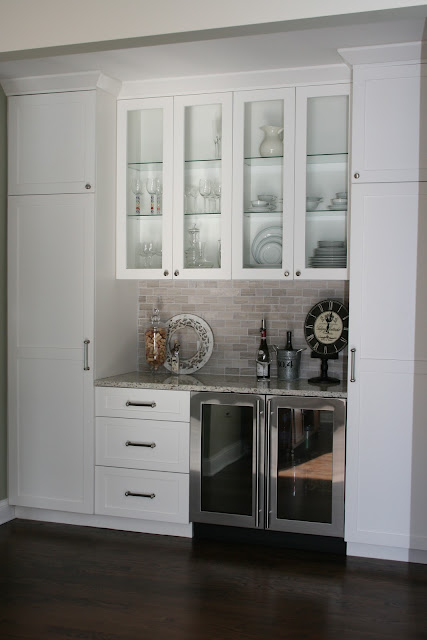
The width and height of the screenshot is (427, 640). I want to click on hardwood floor, so click(x=273, y=587).